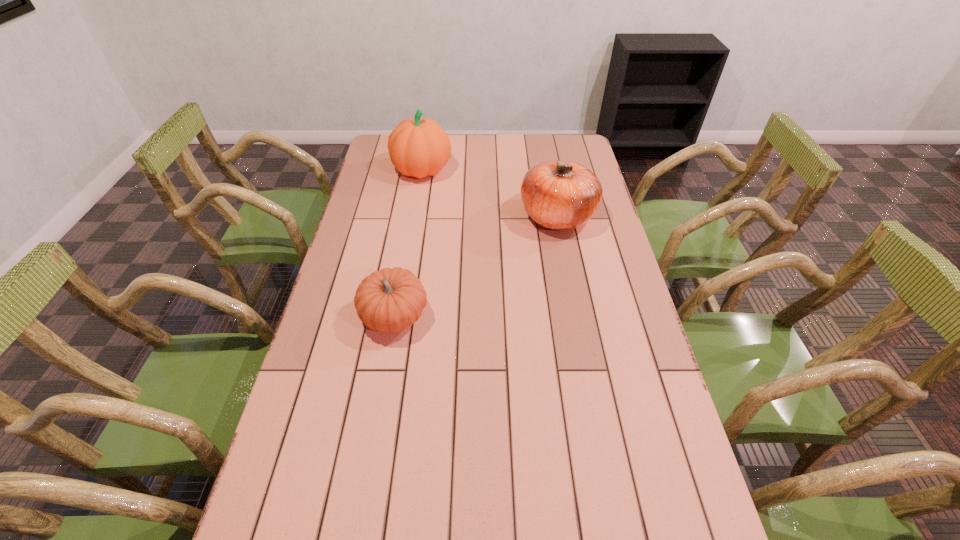
Find the location of a particular element. Image resolution: width=960 pixels, height=540 pixels. object situated at the right edge is located at coordinates (561, 195).

The height and width of the screenshot is (540, 960). What are the coordinates of `object located in the far left corner section of the desktop` in the screenshot? It's located at (418, 147).

Locate an element on the screen. This screenshot has width=960, height=540. free location at the far edge is located at coordinates (468, 159).

Locate an element on the screen. The image size is (960, 540). free spot at the left edge of the desktop is located at coordinates (359, 370).

In the image, there is a desktop. Where is `free space at the far right corner`? free space at the far right corner is located at coordinates (563, 146).

Identify the location of vacant area that lies between the second shortest pumpkin and the farthest object. This screenshot has height=540, width=960. (490, 193).

You are a GUI agent. You are given a task and a screenshot of the screen. Output one action in this format:
    pyautogui.click(x=<x>, y=<y>)
    Task: Click on the free space that is in between the shortest pumpkin and the rightmost pumpkin
    This screenshot has width=960, height=540.
    Given the screenshot: What is the action you would take?
    pyautogui.click(x=476, y=266)

Where is `unoccupied area between the shortest pumpkin and the tallest object`? The height and width of the screenshot is (540, 960). unoccupied area between the shortest pumpkin and the tallest object is located at coordinates (409, 243).

The width and height of the screenshot is (960, 540). What are the coordinates of `vacant area that lies between the rightmost pumpkin and the nearest pumpkin` in the screenshot? It's located at (476, 266).

At what (x,y) coordinates should I click in order to perform the action: click on empty location between the shortest pumpkin and the second tallest pumpkin. Please return your answer as a coordinate pair (x, y). The width and height of the screenshot is (960, 540). Looking at the image, I should click on (476, 266).